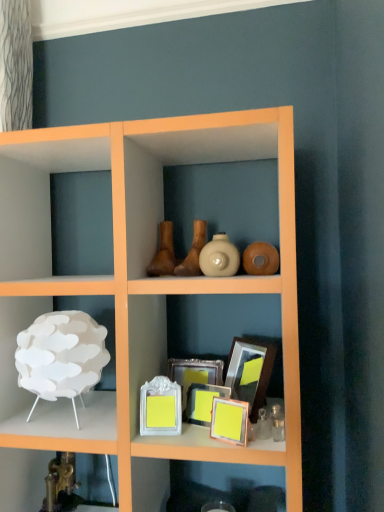
What do you see at coordinates (193, 251) in the screenshot? The width and height of the screenshot is (384, 512). I see `brown matte vase at center, the second vase when ordered from left to right` at bounding box center [193, 251].

Identify the location of metallic gold faucet at lower left, acting as the first shelf starting from the bottom. Image resolution: width=384 pixels, height=512 pixels. pos(23,478).

Describe the element at coordinates (250, 372) in the screenshot. Image resolution: width=384 pixels, height=512 pixels. I see `wooden picture frame at center, arranged as the 4th picture frame when viewed from the front` at that location.

You are a GUI agent. You are given a task and a screenshot of the screen. Output one action in this format:
    pyautogui.click(x=<x>, y=<y>)
    Task: Click on the white glossy picture frame at center, which is the third picture frame from back to front
    The image size is (384, 512).
    Given the screenshot: What is the action you would take?
    click(160, 407)

This screenshot has width=384, height=512. What do you see at coordinates (160, 407) in the screenshot? I see `white glossy picture frame at center, which is the third picture frame from back to front` at bounding box center [160, 407].

What do you see at coordinates (56, 418) in the screenshot? I see `white matte lamp at left, which ranks as the second shelf in bottom-to-top order` at bounding box center [56, 418].

Image resolution: width=384 pixels, height=512 pixels. I want to click on matte yellow picture frame at center, which appears as the 1th picture frame when viewed from the front, so click(229, 421).

Is white glossy picture frame at center, the second picture frame from the front, taller or shorter than yellow matte picture frame at center, which is the second picture frame in back-to-front order?

Considering their sizes, white glossy picture frame at center, the second picture frame from the front, has more height than yellow matte picture frame at center, which is the second picture frame in back-to-front order.

Where is `picture frame on the left side of yellow matte picture frame at center, which is the second picture frame in back-to-front order`? picture frame on the left side of yellow matte picture frame at center, which is the second picture frame in back-to-front order is located at coordinates (160, 407).

Starting from the matte yellow picture frame at center, which appears as the 1th picture frame when viewed from the front, which vase is the 2nd one behind? Please provide its 2D coordinates.

[(193, 251)]

In the scene shown: Is matte yellow picture frame at center, arranged as the 4th picture frame when viewed from the back, oriented away from brown matte vase at center, the second vase when ordered from left to right?

No, matte yellow picture frame at center, arranged as the 4th picture frame when viewed from the back,'s orientation is not away from brown matte vase at center, the second vase when ordered from left to right.

Is matte yellow picture frame at center, which appears as the 1th picture frame when viewed from the front, to the right of brown matte vase at center, arranged as the 2th vase when viewed from the right, from the viewer's perspective?

Yes.

Considering the relative sizes of brown matte vase at center, arranged as the 2th vase when viewed from the right, and metallic gold faucet at lower left, acting as the first shelf starting from the bottom, in the image provided, is brown matte vase at center, arranged as the 2th vase when viewed from the right, taller than metallic gold faucet at lower left, acting as the first shelf starting from the bottom,?

Incorrect, the height of brown matte vase at center, arranged as the 2th vase when viewed from the right, is not larger of that of metallic gold faucet at lower left, acting as the first shelf starting from the bottom.

This screenshot has height=512, width=384. What are the coordinates of `the 2nd vase in front of the metallic gold faucet at lower left, which is counted as the 2th shelf, starting from the top` in the screenshot? It's located at (193, 251).

Could you tell me if brown matte vase at center, arranged as the 2th vase when viewed from the right, is turned towards metallic gold faucet at lower left, acting as the first shelf starting from the bottom?

No, brown matte vase at center, arranged as the 2th vase when viewed from the right, is not facing towards metallic gold faucet at lower left, acting as the first shelf starting from the bottom.

Is brown matte vase at center, arranged as the 2th vase when viewed from the right, not inside metallic gold faucet at lower left, acting as the first shelf starting from the bottom?

Yes, brown matte vase at center, arranged as the 2th vase when viewed from the right, is not within metallic gold faucet at lower left, acting as the first shelf starting from the bottom.

Looking at this image, which of these two, yellow matte picture frame at center, which is the second picture frame in back-to-front order, or white glossy picture frame at center, which is the third picture frame from back to front, is wider?

Wider between the two is white glossy picture frame at center, which is the third picture frame from back to front.

Considering the sizes of yellow matte picture frame at center, which is the second picture frame in back-to-front order, and white glossy picture frame at center, the second picture frame from the front, in the image, is yellow matte picture frame at center, which is the second picture frame in back-to-front order, taller or shorter than white glossy picture frame at center, the second picture frame from the front,?

yellow matte picture frame at center, which is the second picture frame in back-to-front order, is shorter than white glossy picture frame at center, the second picture frame from the front.

From the image's perspective, is yellow matte picture frame at center, which is the second picture frame in back-to-front order, above or below white glossy picture frame at center, which is the third picture frame from back to front?

Based on their image positions, yellow matte picture frame at center, which is the second picture frame in back-to-front order, is located beneath white glossy picture frame at center, which is the third picture frame from back to front.

Is the position of yellow matte picture frame at center, the 3th picture frame from the front, less distant than that of white glossy picture frame at center, the second picture frame from the front?

That is False.

Is brown matte vase at center, arranged as the 2th vase when viewed from the right, to the right of matte brown vase at center, arranged as the first vase when viewed from the left, from the viewer's perspective?

Correct, you'll find brown matte vase at center, arranged as the 2th vase when viewed from the right, to the right of matte brown vase at center, arranged as the first vase when viewed from the left.

Is brown matte vase at center, arranged as the 2th vase when viewed from the right, facing towards matte brown vase at center, the third vase in the right-to-left sequence?

No, brown matte vase at center, arranged as the 2th vase when viewed from the right, is not oriented towards matte brown vase at center, the third vase in the right-to-left sequence.

From a real-world perspective, between brown matte vase at center, arranged as the 2th vase when viewed from the right, and matte brown vase at center, arranged as the first vase when viewed from the left, who is vertically higher?

brown matte vase at center, arranged as the 2th vase when viewed from the right, is physically above.

Is white glossy vase at center, placed as the third vase when sorted from left to right, at the left side of white matte lamp at left, which is counted as the first shelf, starting from the top?

Incorrect, white glossy vase at center, placed as the third vase when sorted from left to right, is not on the left side of white matte lamp at left, which is counted as the first shelf, starting from the top.

Identify the location of the 1st shelf counting from the left of the white glossy vase at center, which is counted as the first vase, starting from the right. The width and height of the screenshot is (384, 512). (56, 418).

From a real-world perspective, which object stands above the other?

white glossy vase at center, placed as the third vase when sorted from left to right, from a real-world perspective.

Who is shorter, white glossy vase at center, placed as the third vase when sorted from left to right, or white matte lamp at left, which is counted as the first shelf, starting from the top?

Standing shorter between the two is white glossy vase at center, placed as the third vase when sorted from left to right.

Is brown matte vase at center, the second vase when ordered from left to right, with wooden picture frame at center, marked as the 1th picture frame in a back-to-front arrangement?

No.

Is point (196, 254) positioned in front of point (255, 387)?

No.

Which object is thinner, brown matte vase at center, the second vase when ordered from left to right, or wooden picture frame at center, arranged as the 4th picture frame when viewed from the front?

Thinner between the two is wooden picture frame at center, arranged as the 4th picture frame when viewed from the front.

From the picture: Is brown matte vase at center, arranged as the 2th vase when viewed from the right, oriented towards wooden picture frame at center, marked as the 1th picture frame in a back-to-front arrangement?

No, brown matte vase at center, arranged as the 2th vase when viewed from the right, is not aimed at wooden picture frame at center, marked as the 1th picture frame in a back-to-front arrangement.

This screenshot has width=384, height=512. I want to click on the 2nd picture frame positioned below the white glossy picture frame at center, the second picture frame from the front (from the image's perspective), so click(202, 402).

This screenshot has width=384, height=512. I want to click on vase that is the 2nd object to the left of the matte yellow picture frame at center, which appears as the 1th picture frame when viewed from the front, starting at the anchor, so click(193, 251).

From the image, which object appears to be farther from white matte lamp at left, which is counted as the first shelf, starting from the top, yellow matte picture frame at center, which is the second picture frame in back-to-front order, or metallic gold faucet at lower left, acting as the first shelf starting from the bottom?

yellow matte picture frame at center, which is the second picture frame in back-to-front order, lies further to white matte lamp at left, which is counted as the first shelf, starting from the top, than the other object.

When comparing their distances from wooden picture frame at center, marked as the 1th picture frame in a back-to-front arrangement, does matte yellow picture frame at center, arranged as the 4th picture frame when viewed from the back, or white glossy vase at center, which is counted as the first vase, starting from the right, seem further?

white glossy vase at center, which is counted as the first vase, starting from the right, lies further to wooden picture frame at center, marked as the 1th picture frame in a back-to-front arrangement, than the other object.

When comparing their distances from brown matte vase at center, the second vase when ordered from left to right, does white glossy vase at center, placed as the third vase when sorted from left to right, or yellow matte picture frame at center, which is the second picture frame in back-to-front order, seem further?

yellow matte picture frame at center, which is the second picture frame in back-to-front order, lies further to brown matte vase at center, the second vase when ordered from left to right, than the other object.

Consider the image. Estimate the real-world distances between objects in this image. Which object is further from yellow matte picture frame at center, the 3th picture frame from the front, metallic gold faucet at lower left, which is counted as the 2th shelf, starting from the top, or brown matte vase at center, the second vase when ordered from left to right?

metallic gold faucet at lower left, which is counted as the 2th shelf, starting from the top, is positioned further to the anchor yellow matte picture frame at center, the 3th picture frame from the front.

Looking at the image, which one is located closer to white glossy vase at center, placed as the third vase when sorted from left to right, matte yellow picture frame at center, arranged as the 4th picture frame when viewed from the back, or brown matte vase at center, the second vase when ordered from left to right?

brown matte vase at center, the second vase when ordered from left to right, is positioned closer to the anchor white glossy vase at center, placed as the third vase when sorted from left to right.

When comparing their distances from metallic gold faucet at lower left, acting as the first shelf starting from the bottom, does matte brown vase at center, arranged as the first vase when viewed from the left, or white matte lamp at left, which is counted as the first shelf, starting from the top, seem further?

Among the two, matte brown vase at center, arranged as the first vase when viewed from the left, is located further to metallic gold faucet at lower left, acting as the first shelf starting from the bottom.

Estimate the real-world distances between objects in this image. Which object is further from white matte lamp at left, which is counted as the first shelf, starting from the top, yellow matte picture frame at center, which is the second picture frame in back-to-front order, or matte yellow picture frame at center, which appears as the 1th picture frame when viewed from the front?

matte yellow picture frame at center, which appears as the 1th picture frame when viewed from the front, is positioned further to the anchor white matte lamp at left, which is counted as the first shelf, starting from the top.

From the picture: When comparing their distances from matte yellow picture frame at center, which appears as the 1th picture frame when viewed from the front, does metallic gold faucet at lower left, acting as the first shelf starting from the bottom, or yellow matte picture frame at center, the 3th picture frame from the front, seem closer?

Based on the image, yellow matte picture frame at center, the 3th picture frame from the front, appears to be nearer to matte yellow picture frame at center, which appears as the 1th picture frame when viewed from the front.

The width and height of the screenshot is (384, 512). Find the location of `picture frame situated between metallic gold faucet at lower left, acting as the first shelf starting from the bottom, and yellow matte picture frame at center, which is the second picture frame in back-to-front order, from left to right`. picture frame situated between metallic gold faucet at lower left, acting as the first shelf starting from the bottom, and yellow matte picture frame at center, which is the second picture frame in back-to-front order, from left to right is located at coordinates tap(160, 407).

Locate an element on the screen. picture frame between white matte lamp at left, which ranks as the second shelf in bottom-to-top order, and yellow matte picture frame at center, the 3th picture frame from the front, from left to right is located at coordinates (160, 407).

I want to click on picture frame between matte brown vase at center, the third vase in the right-to-left sequence, and white glossy picture frame at center, the second picture frame from the front, vertically, so click(x=250, y=372).

Identify the location of vase between matte brown vase at center, arranged as the first vase when viewed from the left, and white glossy picture frame at center, the second picture frame from the front, in the up-down direction. This screenshot has width=384, height=512. 219,257.